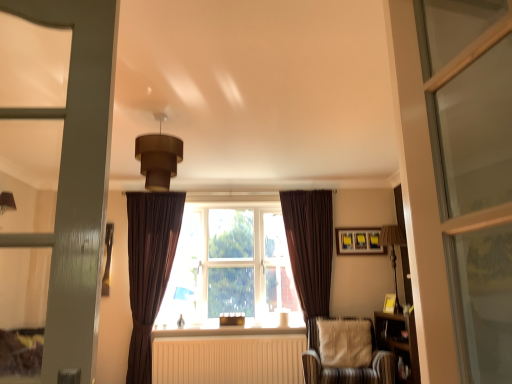
Question: Is brown velvet curtain at right, which ranks as the 2th curtain in left-to-right order, positioned with its back to brown fabric window at center?

Choices:
 (A) no
 (B) yes

Answer: (B)

Question: Does brown velvet curtain at right, which is the 1th curtain in right-to-left order, have a smaller size compared to brown fabric window at center?

Choices:
 (A) no
 (B) yes

Answer: (B)

Question: Considering the relative positions of brown velvet curtain at right, which ranks as the 2th curtain in left-to-right order, and brown fabric window at center in the image provided, is brown velvet curtain at right, which ranks as the 2th curtain in left-to-right order, in front of brown fabric window at center?

Choices:
 (A) no
 (B) yes

Answer: (B)

Question: Is brown velvet curtain at right, which is the 1th curtain in right-to-left order, at the left side of brown fabric window at center?

Choices:
 (A) yes
 (B) no

Answer: (B)

Question: Can you confirm if brown velvet curtain at right, which is the 1th curtain in right-to-left order, is bigger than brown fabric window at center?

Choices:
 (A) yes
 (B) no

Answer: (B)

Question: Does point (378, 251) appear closer or farther from the camera than point (129, 263)?

Choices:
 (A) closer
 (B) farther

Answer: (B)

Question: Based on their sizes in the image, would you say matte yellow picture frame at upper right is bigger or smaller than brown velvet curtain at left, which is the first curtain from left to right?

Choices:
 (A) small
 (B) big

Answer: (A)

Question: In terms of width, does matte yellow picture frame at upper right look wider or thinner when compared to brown velvet curtain at left, which is the first curtain from left to right?

Choices:
 (A) thin
 (B) wide

Answer: (A)

Question: Relative to brown velvet curtain at left, the 2th curtain viewed from the right, is matte yellow picture frame at upper right in front or behind?

Choices:
 (A) front
 (B) behind

Answer: (B)

Question: From the image's perspective, relative to matte yellow picture frame at upper right, is brown velvet curtain at right, which is the 1th curtain in right-to-left order, above or below?

Choices:
 (A) below
 (B) above

Answer: (A)

Question: Based on their sizes in the image, would you say brown velvet curtain at right, which is the 1th curtain in right-to-left order, is bigger or smaller than matte yellow picture frame at upper right?

Choices:
 (A) small
 (B) big

Answer: (B)

Question: Is brown velvet curtain at right, which ranks as the 2th curtain in left-to-right order, inside the boundaries of matte yellow picture frame at upper right, or outside?

Choices:
 (A) inside
 (B) outside

Answer: (B)

Question: Looking at their shapes, would you say brown velvet curtain at right, which is the 1th curtain in right-to-left order, is wider or thinner than matte yellow picture frame at upper right?

Choices:
 (A) wide
 (B) thin

Answer: (A)

Question: Would you say white matte radiator at center is to the left or to the right of striped fabric chair at lower right in the picture?

Choices:
 (A) right
 (B) left

Answer: (B)

Question: Considering the positions of white matte radiator at center and striped fabric chair at lower right in the image, is white matte radiator at center bigger or smaller than striped fabric chair at lower right?

Choices:
 (A) small
 (B) big

Answer: (A)